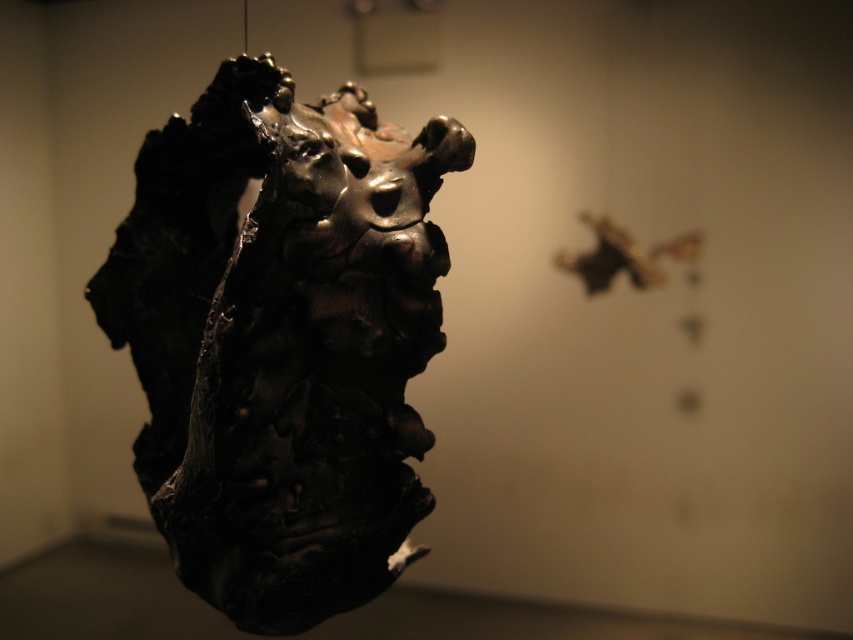
Question: Is matte black sculpture at center bigger than shiny metallic butterfly at upper right?

Choices:
 (A) no
 (B) yes

Answer: (B)

Question: Does matte black sculpture at center have a smaller size compared to shiny metallic butterfly at upper right?

Choices:
 (A) no
 (B) yes

Answer: (A)

Question: Can you confirm if matte black sculpture at center is wider than shiny metallic butterfly at upper right?

Choices:
 (A) no
 (B) yes

Answer: (B)

Question: Which of the following is the farthest from the observer?

Choices:
 (A) (610, 236)
 (B) (202, 504)

Answer: (A)

Question: Which point appears closest to the camera in this image?

Choices:
 (A) (318, 618)
 (B) (593, 266)

Answer: (A)